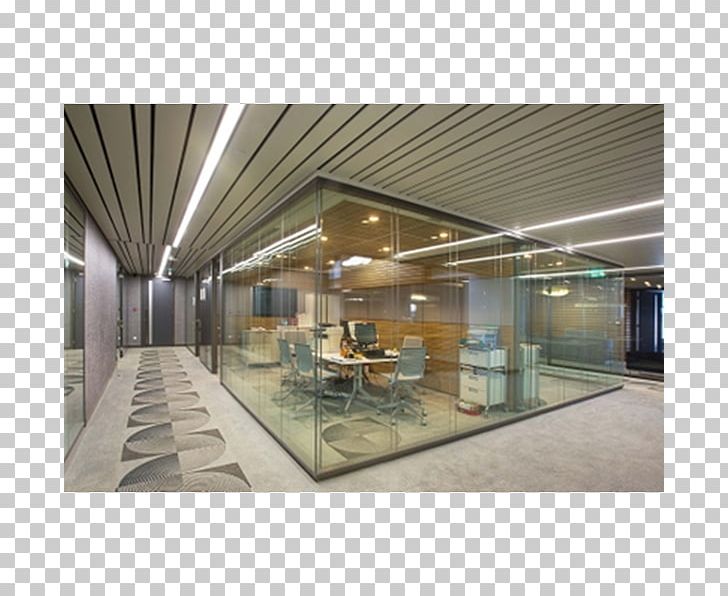
You are a GUI agent. You are given a task and a screenshot of the screen. Output one action in this format:
    pyautogui.click(x=<x>, y=<y>)
    Task: Click on the windows
    
    Given the screenshot: What is the action you would take?
    pyautogui.click(x=197, y=307), pyautogui.click(x=237, y=322), pyautogui.click(x=290, y=331), pyautogui.click(x=343, y=343), pyautogui.click(x=399, y=340), pyautogui.click(x=445, y=332), pyautogui.click(x=507, y=337), pyautogui.click(x=533, y=339), pyautogui.click(x=566, y=331), pyautogui.click(x=622, y=318)